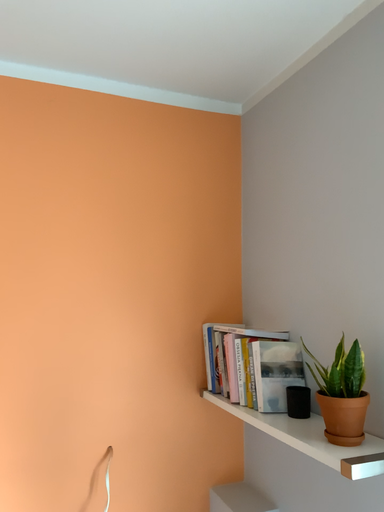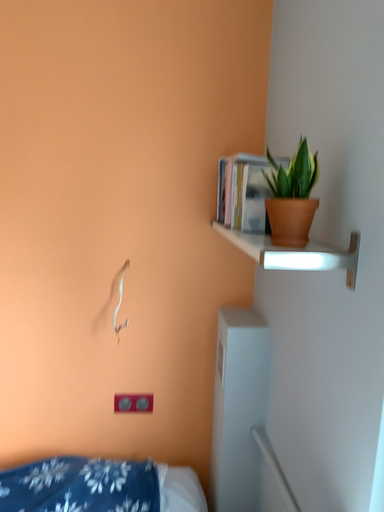
Question: Which way did the camera rotate in the video?

Choices:
 (A) rotated left
 (B) rotated right

Answer: (A)